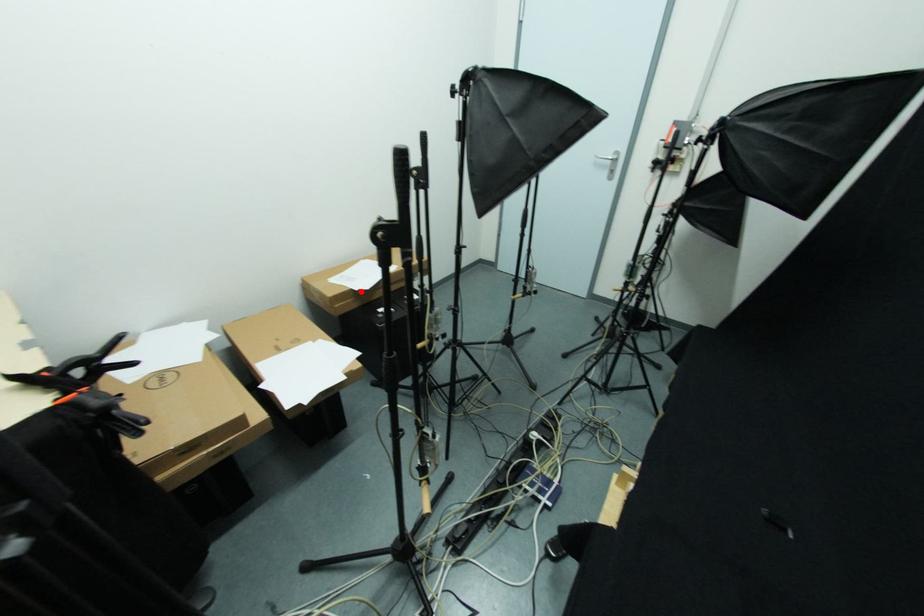
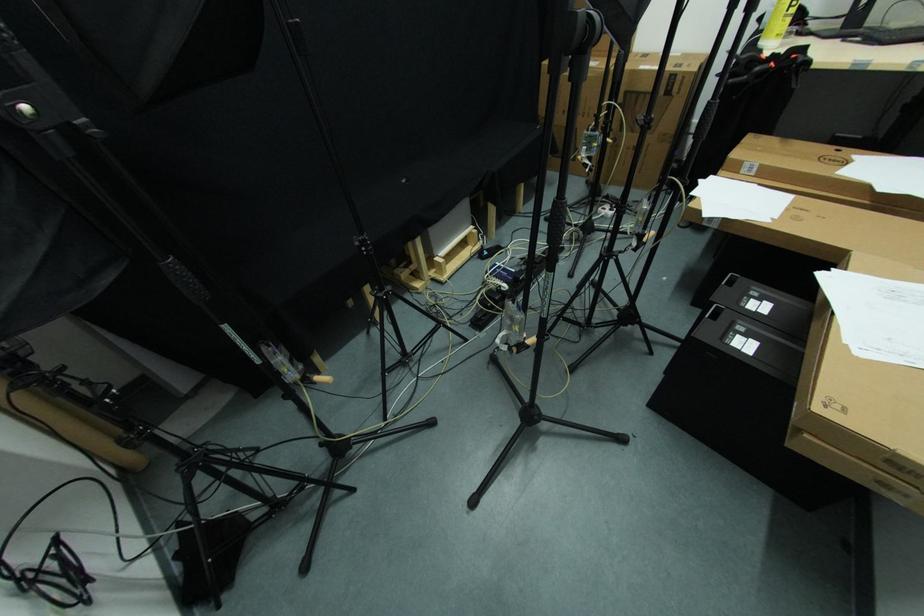
Question: I am providing you with two images of the same scene from different viewpoints. A red point is shown in image1. For the corresponding object point in image2, is it positioned nearer or farther from the camera?

Choices:
 (A) Nearer
 (B) Farther

Answer: (B)